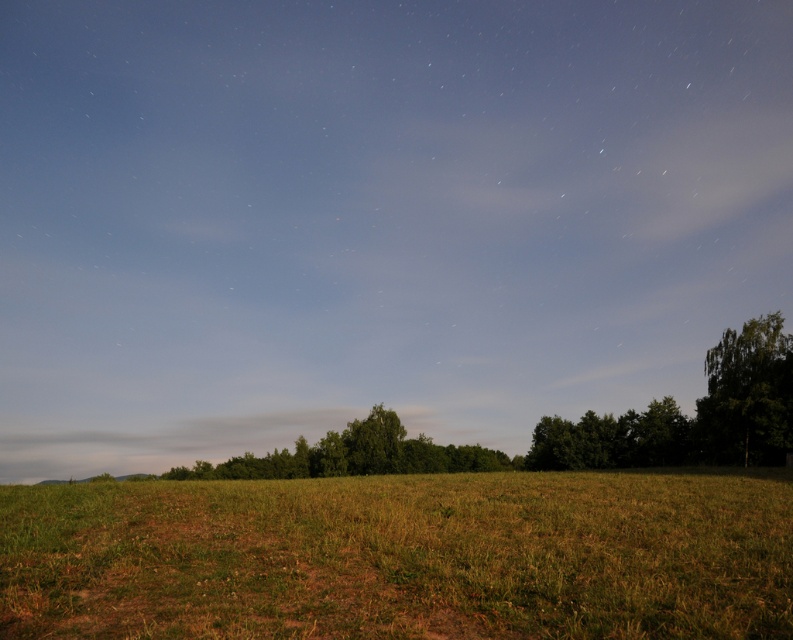
You are standing in the middle of the green grassy field at lower center and want to walk to the green leafy tree at right. Which direction should you face to head directly towards the tree?

You should face towards the right direction to head directly towards the green leafy tree at right from the green grassy field at lower center.

You are standing at the center of the field and want to walk towards the green grassy field at lower center. Which direction should you move?

You should move towards the lower center direction to reach the green grassy field at lower center.

You are standing in the open field and want to walk towards the green leafy tree at right and the green leafy tree at center. Which tree will you reach first?

You will reach the green leafy tree at right first because it is in front of the green leafy tree at center, making it closer to your current position.